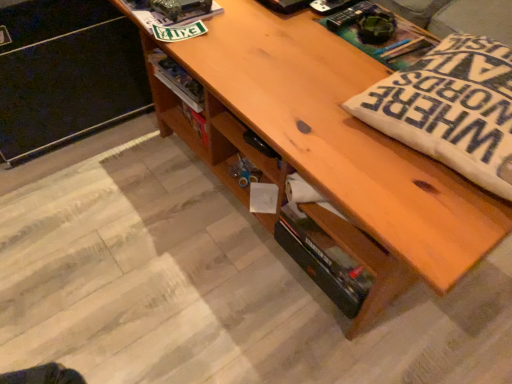
Question: From a real-world perspective, is wooden file cabinet at lower left over wooden shelf at upper center?

Choices:
 (A) no
 (B) yes

Answer: (A)

Question: From the image's perspective, is wooden file cabinet at lower left above wooden shelf at upper center?

Choices:
 (A) no
 (B) yes

Answer: (B)

Question: From a real-world perspective, is wooden file cabinet at lower left below wooden shelf at upper center?

Choices:
 (A) no
 (B) yes

Answer: (B)

Question: Can you confirm if wooden file cabinet at lower left is positioned to the right of wooden shelf at upper center?

Choices:
 (A) yes
 (B) no

Answer: (B)

Question: Does wooden file cabinet at lower left come behind wooden shelf at upper center?

Choices:
 (A) no
 (B) yes

Answer: (A)

Question: Considering the relative sizes of wooden file cabinet at lower left and wooden shelf at upper center in the image provided, is wooden file cabinet at lower left bigger than wooden shelf at upper center?

Choices:
 (A) no
 (B) yes

Answer: (B)

Question: From a real-world perspective, is wooden file cabinet at lower left beneath white fabric pillow at right?

Choices:
 (A) no
 (B) yes

Answer: (B)

Question: Is wooden file cabinet at lower left shorter than white fabric pillow at right?

Choices:
 (A) no
 (B) yes

Answer: (A)

Question: Can you confirm if wooden file cabinet at lower left is taller than white fabric pillow at right?

Choices:
 (A) yes
 (B) no

Answer: (A)

Question: Does wooden file cabinet at lower left have a lesser width compared to white fabric pillow at right?

Choices:
 (A) yes
 (B) no

Answer: (A)

Question: Considering the relative positions of wooden file cabinet at lower left and white fabric pillow at right in the image provided, is wooden file cabinet at lower left to the right of white fabric pillow at right from the viewer's perspective?

Choices:
 (A) yes
 (B) no

Answer: (B)

Question: Is wooden file cabinet at lower left positioned before white fabric pillow at right?

Choices:
 (A) no
 (B) yes

Answer: (A)

Question: Does white fabric pillow at right have a smaller size compared to wooden file cabinet at lower left?

Choices:
 (A) yes
 (B) no

Answer: (A)